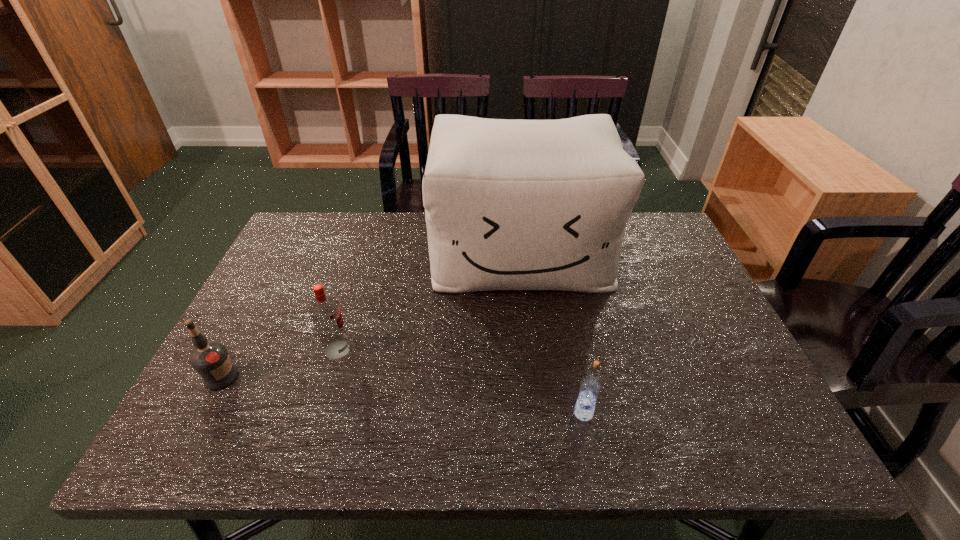
At what (x,y) coordinates should I click in order to perform the action: click on cushion. Please return your answer as a coordinate pair (x, y). Image resolution: width=960 pixels, height=540 pixels. Looking at the image, I should click on (518, 204).

This screenshot has height=540, width=960. Find the location of `the farthest object`. the farthest object is located at coordinates (518, 204).

The width and height of the screenshot is (960, 540). Find the location of `the second vodka from right to left`. the second vodka from right to left is located at coordinates (325, 312).

At what (x,y) coordinates should I click in order to perform the action: click on the second farthest object. Please return your answer as a coordinate pair (x, y). This screenshot has width=960, height=540. Looking at the image, I should click on (325, 312).

The height and width of the screenshot is (540, 960). I want to click on the second nearest vodka, so pyautogui.click(x=210, y=360).

The image size is (960, 540). In order to click on the second nearest object in this screenshot , I will do `click(210, 360)`.

Locate an element on the screen. The width and height of the screenshot is (960, 540). the nearest vodka is located at coordinates (590, 387).

Where is `the rightmost vodka`? The width and height of the screenshot is (960, 540). the rightmost vodka is located at coordinates (590, 387).

Identify the location of vacant space located 0.170m on the side of the tallest object with the smiley face. (532, 348).

Image resolution: width=960 pixels, height=540 pixels. Find the location of `vacant space located 0.090m on the front label of the third nearest object`. vacant space located 0.090m on the front label of the third nearest object is located at coordinates (390, 350).